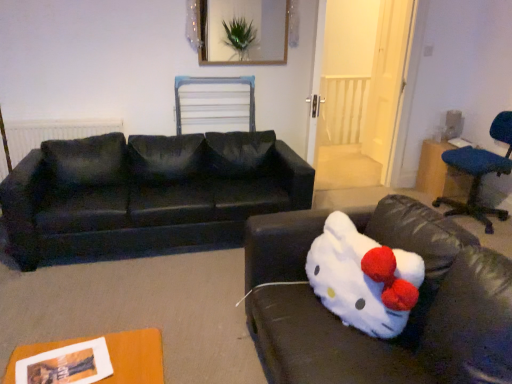
This screenshot has width=512, height=384. Identify the location of vacant space in blue fabric chair at right (from a real-world perspective). (465, 210).